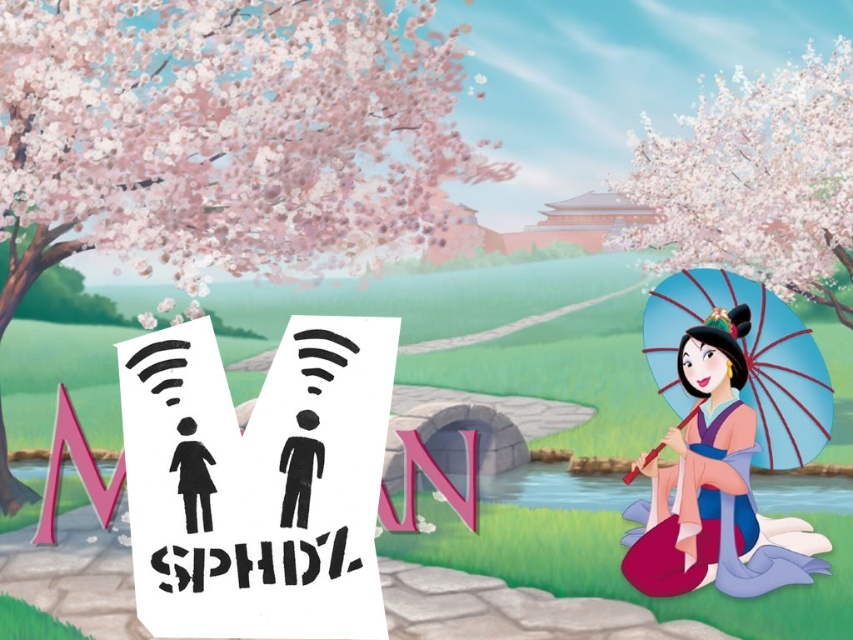
Question: Can you confirm if black paper sign at center is smaller than matte blue umbrella at right?

Choices:
 (A) yes
 (B) no

Answer: (A)

Question: In this image, where is matte blue umbrella at right located relative to black paper at center?

Choices:
 (A) left
 (B) right

Answer: (B)

Question: Estimate the real-world distances between objects in this image. Which object is farther from the matte blue umbrella at right?

Choices:
 (A) black paper sign at center
 (B) black paper at center

Answer: (B)

Question: Can you confirm if black paper sign at center is wider than matte blue umbrella at right?

Choices:
 (A) no
 (B) yes

Answer: (A)

Question: Which object appears farthest from the camera in this image?

Choices:
 (A) black paper sign at center
 (B) black matte figure at center

Answer: (B)

Question: Which object appears closest to the camera in this image?

Choices:
 (A) black paper at center
 (B) matte blue umbrella at right

Answer: (A)